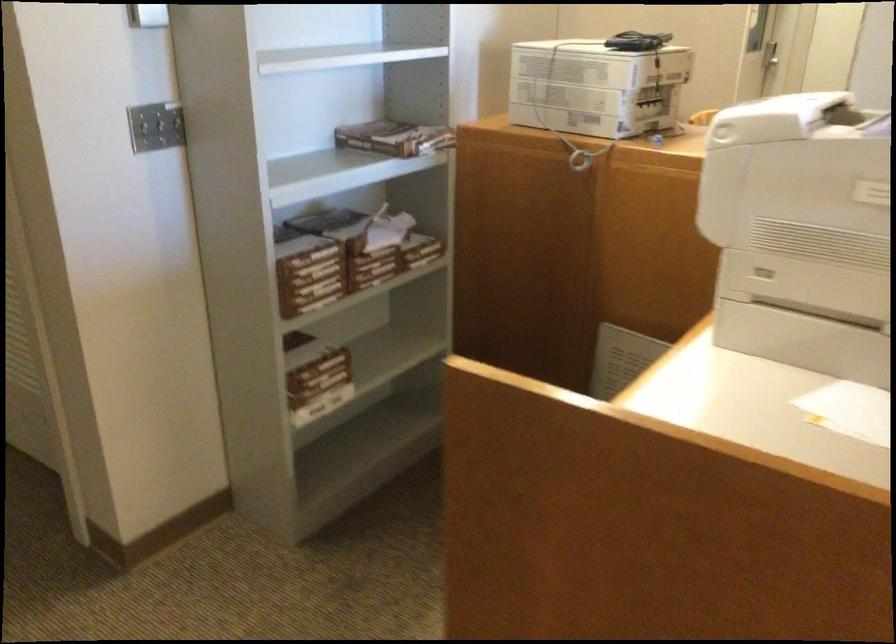
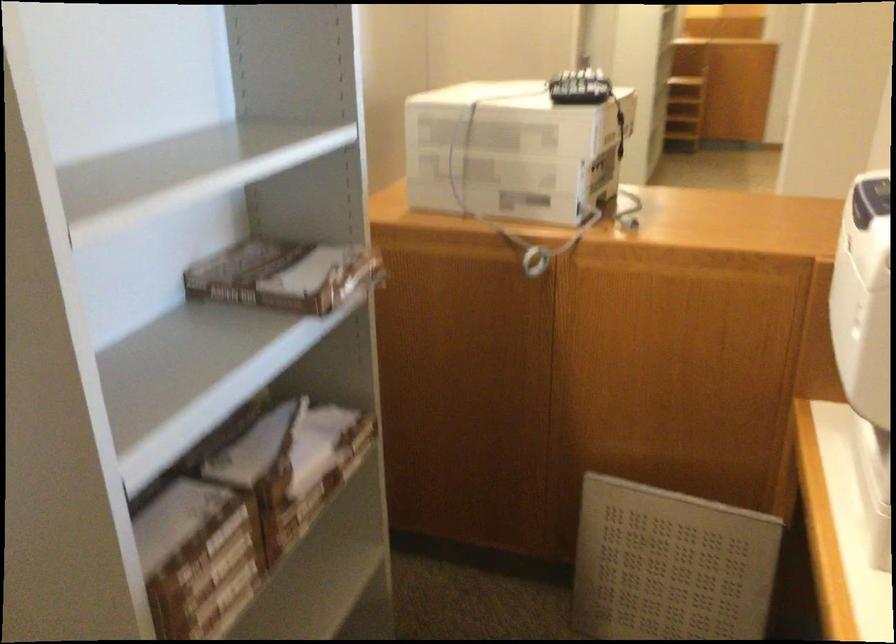
Question: The images are taken continuously from a first-person perspective. In which direction is your viewpoint rotating?

Choices:
 (A) Left
 (B) Right
 (C) Up
 (D) Down

Answer: (B)